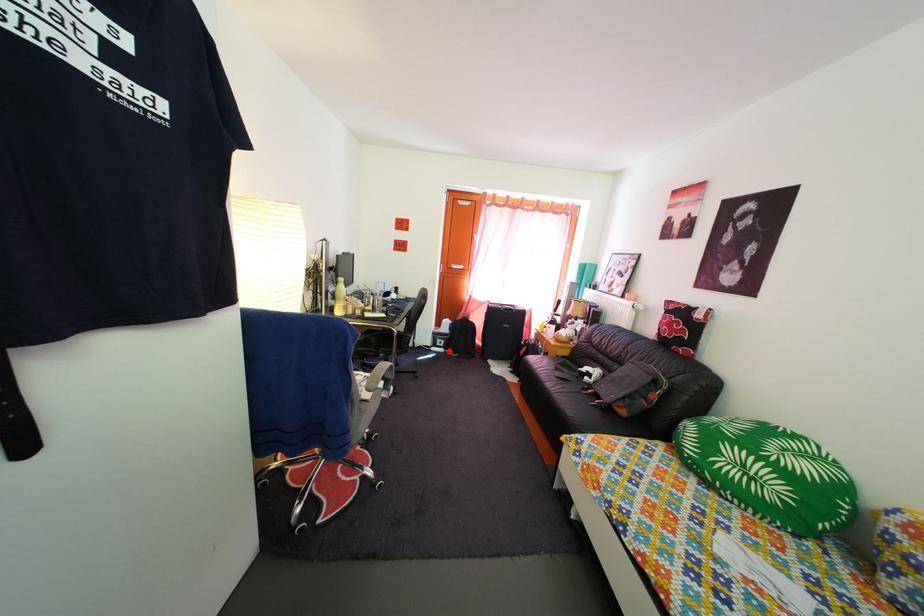
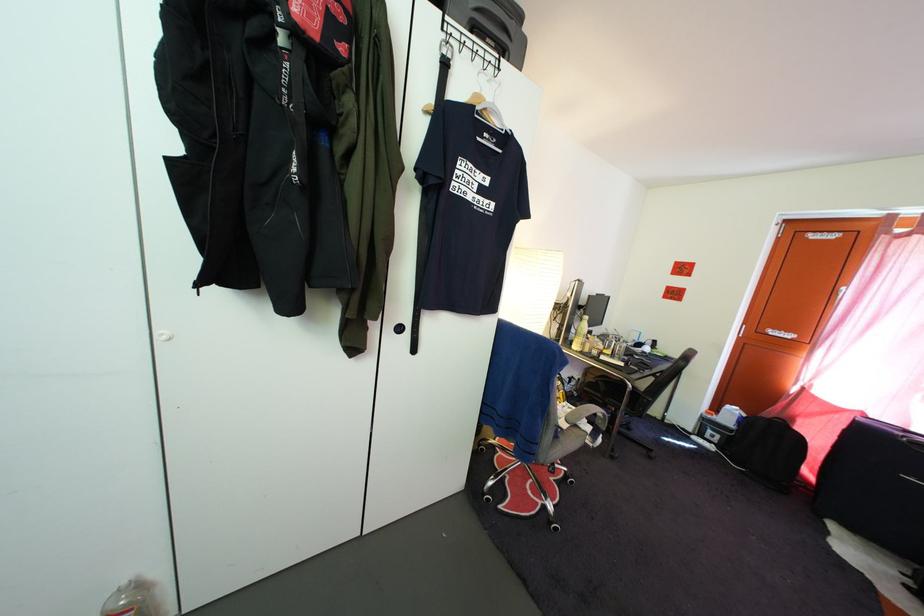
Question: I am providing you with two images of the same scene from different viewpoints. In image1, a red point is highlighted. Considering the same 3D point in image2, which of the following is correct?

Choices:
 (A) It is closer
 (B) It is farther

Answer: (A)